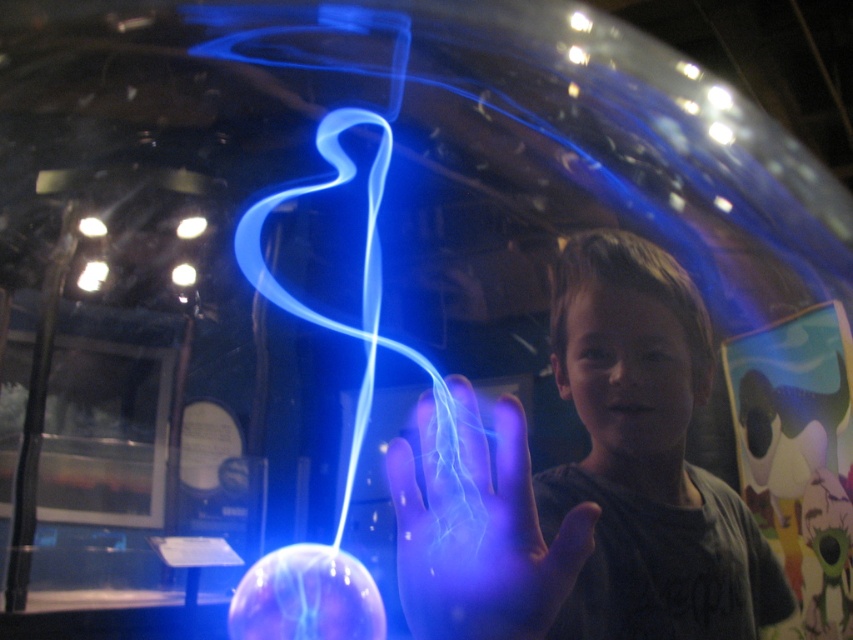
Question: Which point is closer to the camera taking this photo?

Choices:
 (A) (621, 308)
 (B) (485, 474)

Answer: (B)

Question: Can you confirm if translucent blue hand at center is positioned to the right of translucent glass sphere at center?

Choices:
 (A) no
 (B) yes

Answer: (B)

Question: Can you confirm if matte black shirt at center is positioned below translucent blue hand at center?

Choices:
 (A) no
 (B) yes

Answer: (A)

Question: Which of the following is the closest to the observer?

Choices:
 (A) (349, 612)
 (B) (691, 616)

Answer: (B)

Question: Which object is farther from the camera taking this photo?

Choices:
 (A) matte black shirt at center
 (B) translucent glass sphere at center
 (C) translucent blue hand at center

Answer: (B)

Question: Can you confirm if matte black shirt at center is thinner than translucent glass sphere at center?

Choices:
 (A) yes
 (B) no

Answer: (A)